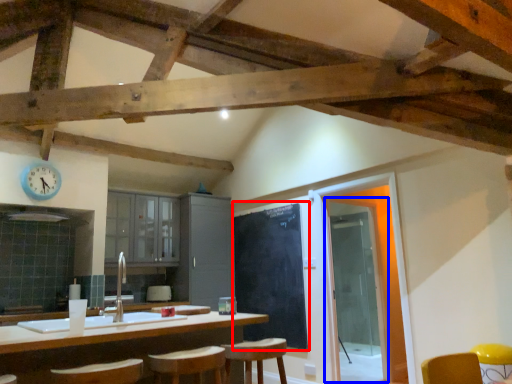
Question: Which point is closer to the camera, bulletin board (highlighted by a red box) or glass door (highlighted by a blue box)?

Choices:
 (A) bulletin board
 (B) glass door

Answer: (B)